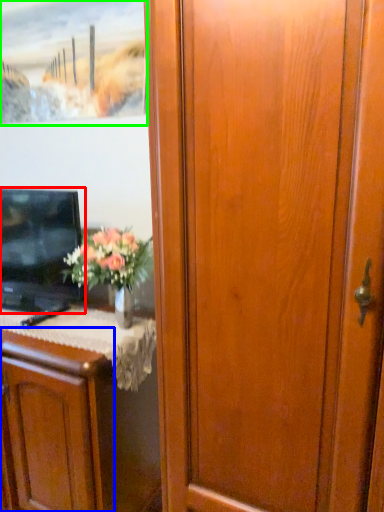
Question: Which object is the closest to the television (highlighted by a red box)? Choose among these: cabinetry (highlighted by a blue box) or picture frame (highlighted by a green box).

Choices:
 (A) cabinetry
 (B) picture frame

Answer: (A)